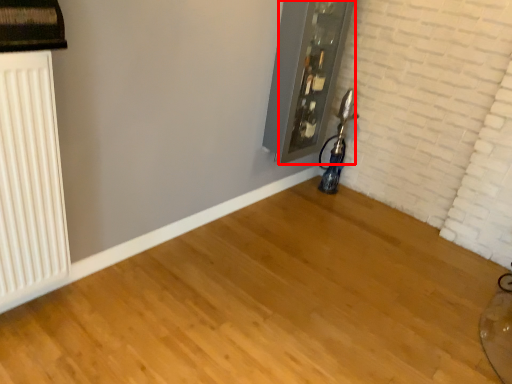
Question: From the image's perspective, where is window frame (annotated by the red box) located in relation to radiator in the image?

Choices:
 (A) below
 (B) above

Answer: (B)